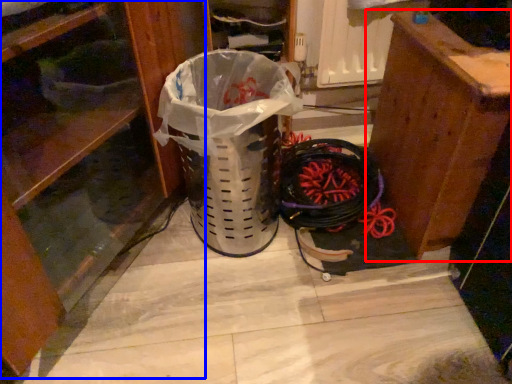
Question: Which object appears farthest to the camera in this image, furniture (highlighted by a red box) or dresser (highlighted by a blue box)?

Choices:
 (A) furniture
 (B) dresser

Answer: (A)